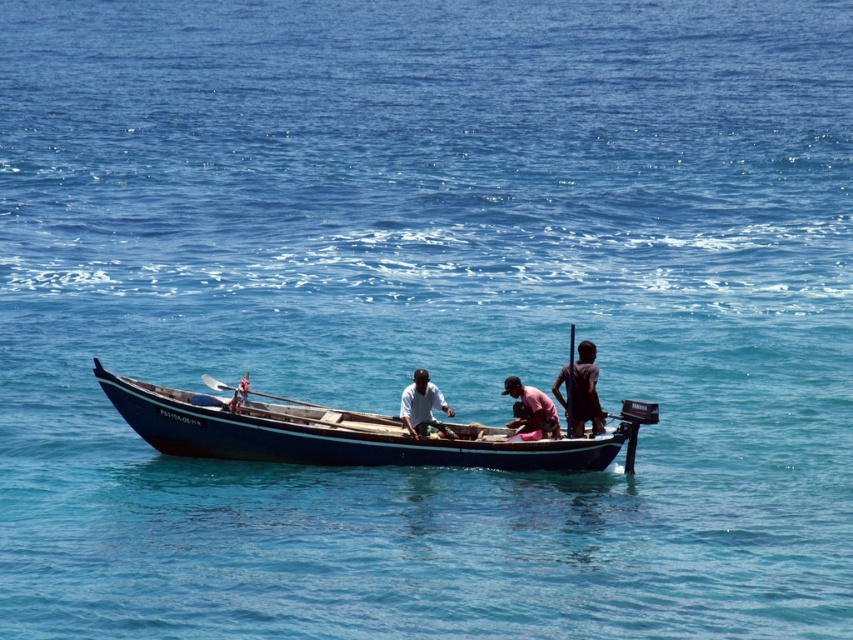
Between white matte shirt at center and wooden paddle at center, which one has more height?

Standing taller between the two is white matte shirt at center.

Identify the location of white matte shirt at center. (422, 406).

The image size is (853, 640). Identify the location of white matte shirt at center. (422, 406).

Which is in front, point (583, 401) or point (553, 413)?

Positioned in front is point (583, 401).

Is dark brown wooden boat at center to the right of pink fabric at center from the viewer's perspective?

Correct, you'll find dark brown wooden boat at center to the right of pink fabric at center.

Is point (585, 362) positioned in front of point (511, 376)?

Yes, it is.

Find the location of `dark brown wooden boat at center`. dark brown wooden boat at center is located at coordinates (581, 392).

Can you confirm if dark brown wooden boat at center is positioned above wooden paddle at center?

A: Yes, dark brown wooden boat at center is above wooden paddle at center.

Who is taller, dark brown wooden boat at center or wooden paddle at center?

With more height is dark brown wooden boat at center.

Is point (585, 352) farther from viewer compared to point (202, 376)?

No, it is not.

Where is `dark brown wooden boat at center`? The height and width of the screenshot is (640, 853). dark brown wooden boat at center is located at coordinates (581, 392).